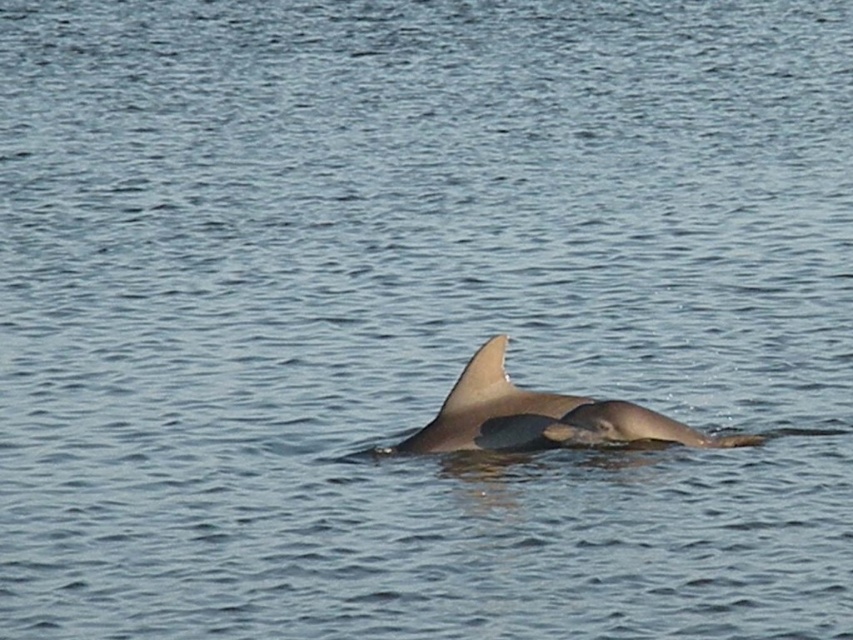
You are a marine biologist observing the two smooth gray creatures in the water. Which one is bigger between the smooth gray dolphin at center and the smooth gray fin at center?

The smooth gray dolphin at center is larger in size than the smooth gray fin at center.

You are a marine biologist observing two points in the water where dolphins are swimming. The points are labeled as point 1 at coordinates point [490,394] and point 2 at coordinates point [495,355]. Based on your observation, which point is farther away from the observer?

Point [490,394] is behind point [495,355], so it is farther away from the observer.

You are a marine biologist observing the two smooth gray objects in the water. Which one is wider, the smooth gray dolphin at center or the smooth gray fin at center?

The smooth gray dolphin at center is wider than the smooth gray fin at center according to the description.